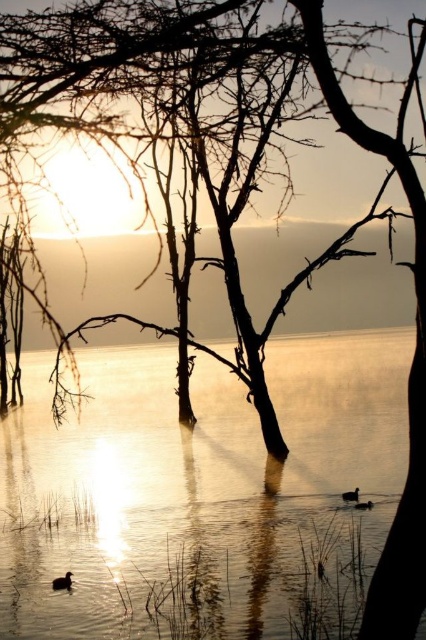
Consider the image. You are a photographer trying to capture both the dark brown feathered duck at center and the brown matte duck at lower center in a single shot. Which duck will appear larger in your photo?

The dark brown feathered duck at center will appear larger in the photo because it is closer to the viewer than the brown matte duck at lower center.